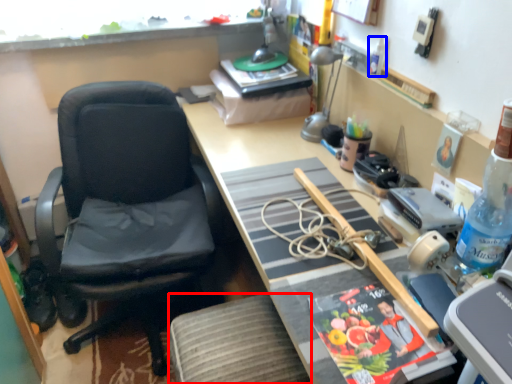
Question: Which of the following is the closest to the observer, stool (highlighted by a red box) or bottle (highlighted by a blue box)?

Choices:
 (A) stool
 (B) bottle

Answer: (A)